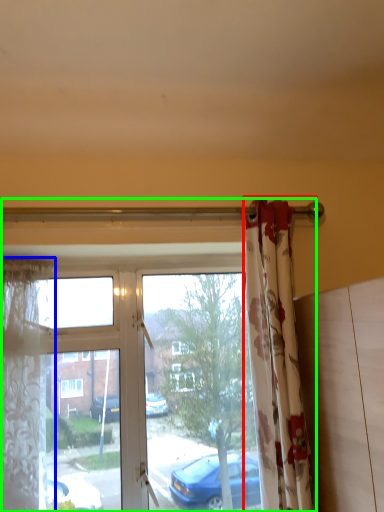
Question: Which object is the closest to the curtain (highlighted by a red box)? Choose among these: curtain (highlighted by a blue box) or window (highlighted by a green box).

Choices:
 (A) curtain
 (B) window

Answer: (B)